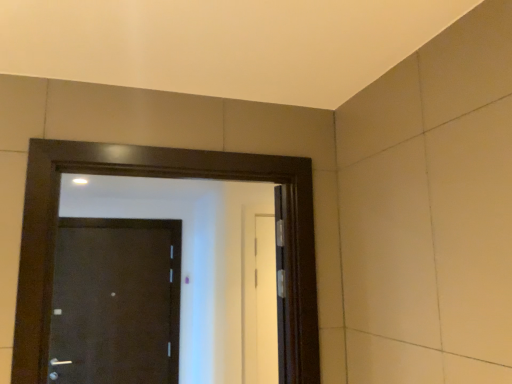
Question: Which direction should I rotate to look at black glossy door at center, which ranks as the 2th door in left-to-right order?

Choices:
 (A) left
 (B) right

Answer: (A)

Question: Which direction should I rotate to look at matte black door at center, placed as the 1th door when sorted from back to front, — up or down?

Choices:
 (A) up
 (B) down

Answer: (B)

Question: Considering the relative sizes of black glossy door at center, which appears as the 2th door when viewed from the back, and matte black door at center, placed as the 1th door when sorted from back to front, in the image provided, is black glossy door at center, which appears as the 2th door when viewed from the back, wider than matte black door at center, placed as the 1th door when sorted from back to front,?

Choices:
 (A) yes
 (B) no

Answer: (A)

Question: From a real-world perspective, is black glossy door at center, which appears as the 2th door when viewed from the back, on matte black door at center, the 2th door in the right-to-left sequence?

Choices:
 (A) no
 (B) yes

Answer: (B)

Question: Can you confirm if black glossy door at center, placed as the first door when sorted from front to back, is smaller than matte black door at center, the 2th door in the right-to-left sequence?

Choices:
 (A) no
 (B) yes

Answer: (A)

Question: Can you confirm if black glossy door at center, which is counted as the 1th door, starting from the right, is shorter than matte black door at center, the second door viewed from the front?

Choices:
 (A) yes
 (B) no

Answer: (A)

Question: Is matte black door at center, the 2th door in the right-to-left sequence, located within black glossy door at center, which appears as the 2th door when viewed from the back?

Choices:
 (A) no
 (B) yes

Answer: (A)

Question: Does black glossy door at center, which ranks as the 2th door in left-to-right order, appear on the left side of matte black door at center, the 2th door in the right-to-left sequence?

Choices:
 (A) no
 (B) yes

Answer: (A)

Question: Is matte black door at center, the 2th door in the right-to-left sequence, far from black glossy door at center, which ranks as the 2th door in left-to-right order?

Choices:
 (A) no
 (B) yes

Answer: (B)

Question: Is matte black door at center, the second door viewed from the front, beside black glossy door at center, which appears as the 2th door when viewed from the back?

Choices:
 (A) yes
 (B) no

Answer: (B)

Question: Is matte black door at center, the second door viewed from the front, positioned before black glossy door at center, which is counted as the 1th door, starting from the right?

Choices:
 (A) no
 (B) yes

Answer: (A)

Question: Is matte black door at center, placed as the first door when sorted from left to right, shorter than black glossy door at center, placed as the first door when sorted from front to back?

Choices:
 (A) yes
 (B) no

Answer: (B)

Question: Is matte black door at center, the 2th door in the right-to-left sequence, positioned with its back to black glossy door at center, which appears as the 2th door when viewed from the back?

Choices:
 (A) no
 (B) yes

Answer: (A)

Question: Can you confirm if matte black door at center, the 2th door in the right-to-left sequence, is taller than black glossy door at center, which is counted as the 1th door, starting from the right?

Choices:
 (A) no
 (B) yes

Answer: (B)

Question: Considering the positions of point (176, 244) and point (16, 326), is point (176, 244) closer or farther from the camera than point (16, 326)?

Choices:
 (A) closer
 (B) farther

Answer: (B)